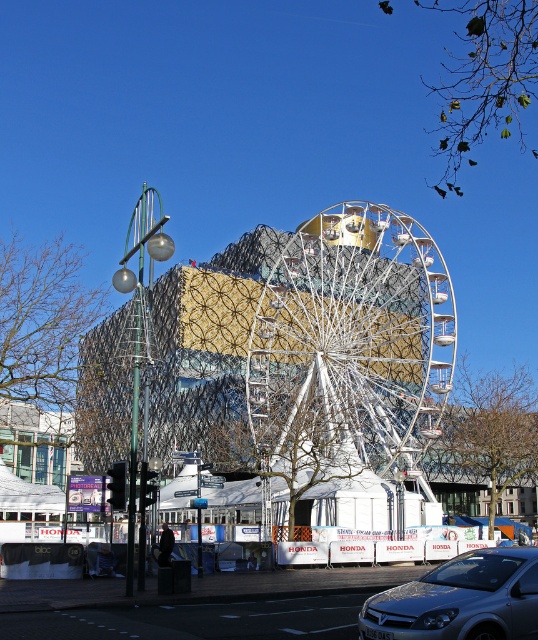
You are a photographer standing at the base of the white metallic ferris wheel at center and want to take a photo of the silver metallic car at lower right. Given that the ferris wheel is taller than the car, will the car be fully visible in the photo if you aim your camera straight ahead?

The white metallic ferris wheel at center is taller than the silver metallic car at lower right, so if you aim your camera straight ahead, the car will be fully visible as it is shorter and positioned lower right relative to the ferris wheel.

You are an architect analyzing the urban layout. You observe the white metallic ferris wheel at center and the white metallic wheel at center. Which one is closer to the observer?

The white metallic ferris wheel at center is closer to the observer because the white metallic wheel at center is positioned behind it.

You are a photographer standing at the lower left corner of the scene. You want to capture both the white metallic ferris wheel at center and the silver metallic car at lower right in a single shot. Which object should you position closer to the edge of your camera frame to include both?

To include both the white metallic ferris wheel at center and the silver metallic car at lower right in a single shot, you should position the silver metallic car at lower right closer to the edge of your camera frame since the ferris wheel at center is already on the right side of the car.